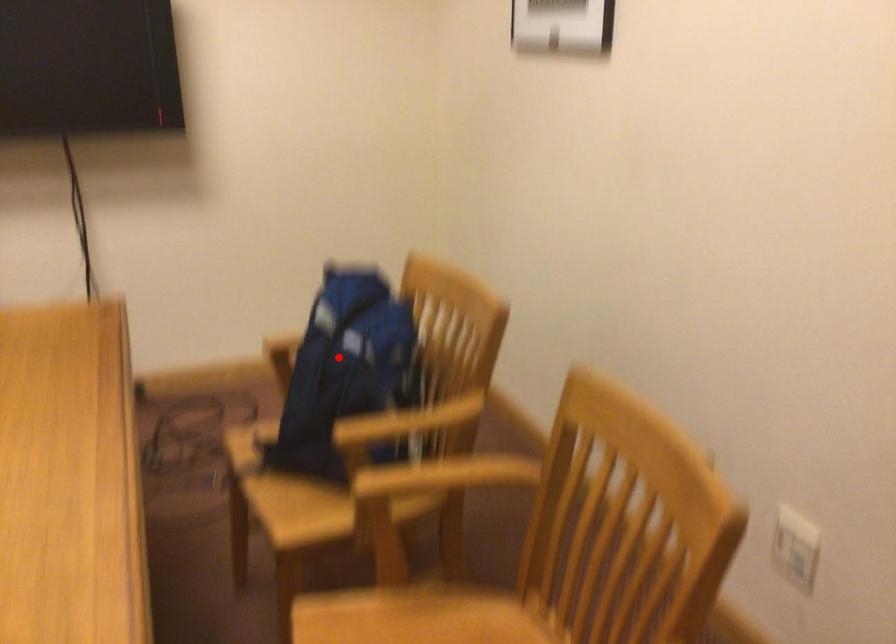
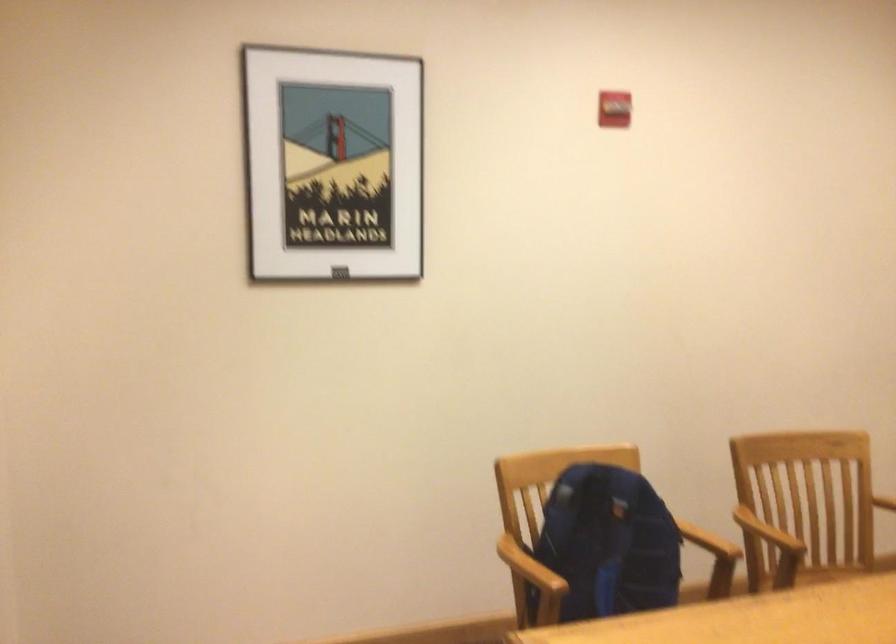
Question: I am providing you with two images of the same scene from different viewpoints. In image1, a red point is highlighted. Considering the same 3D point in image2, which of the following is correct?

Choices:
 (A) It is closer
 (B) It is farther

Answer: (B)